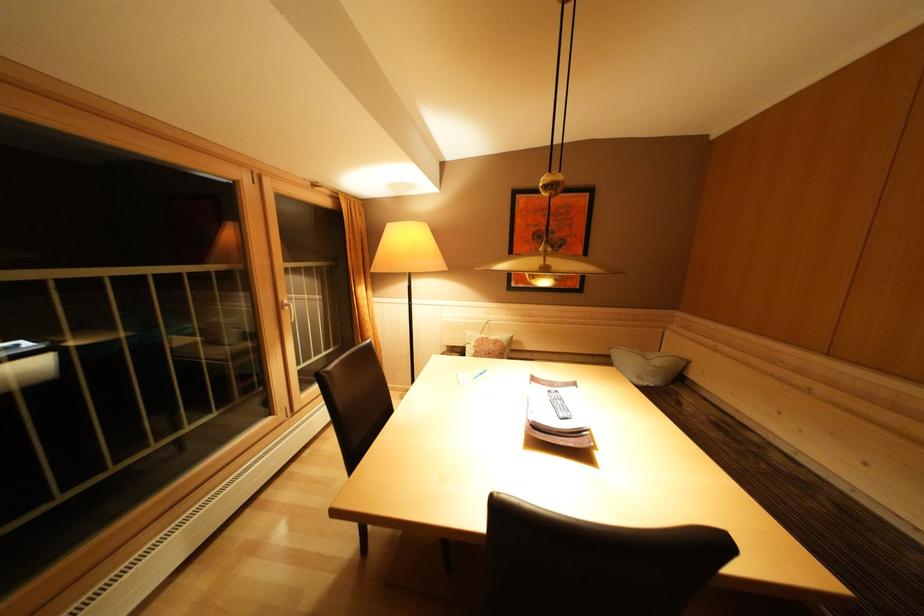
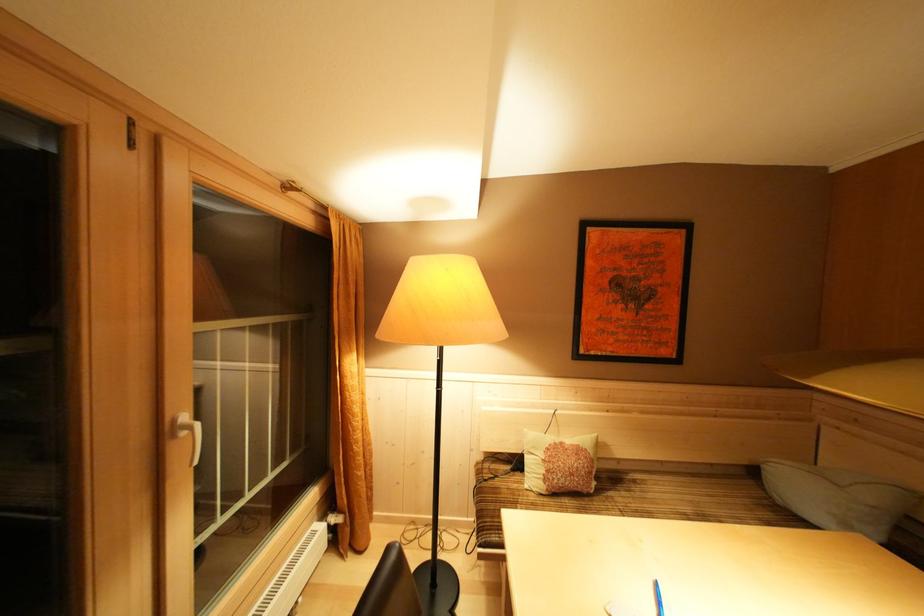
In the second image, find the point that corresponds to pixel 294 313 in the first image.

(190, 438)